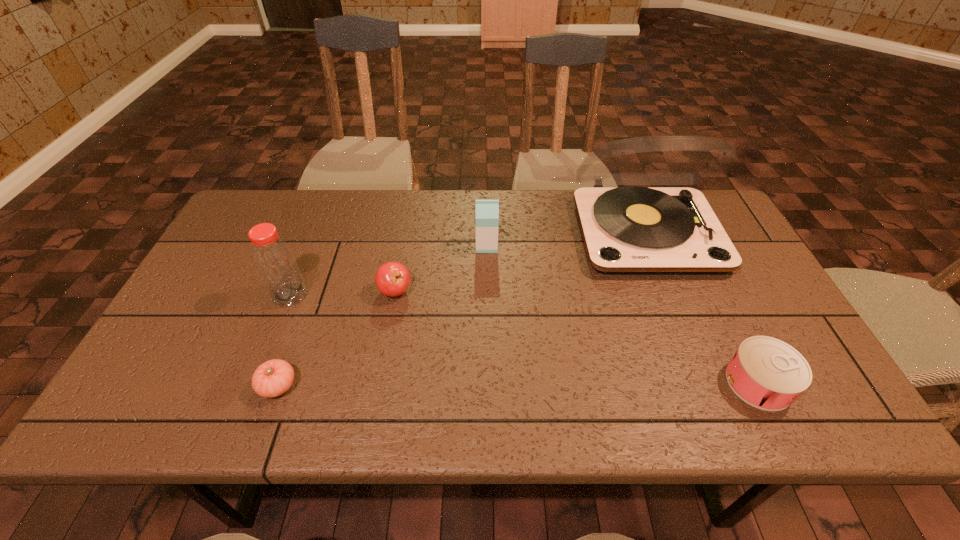
In order to click on vacant space located on the front of the fourth object from right to left in this screenshot , I will do `click(389, 326)`.

The width and height of the screenshot is (960, 540). In order to click on free spot located 0.190m on the back of the second shortest object in this screenshot , I will do `click(715, 294)`.

What are the coordinates of `vacant space positioned on the right of the shortest object` in the screenshot? It's located at (338, 386).

Identify the location of object that is at the far edge. click(627, 230).

You are a GUI agent. You are given a task and a screenshot of the screen. Output one action in this format:
    pyautogui.click(x=<x>, y=<y>)
    Task: Click on the can that is positioned at the near edge
    Image resolution: width=960 pixels, height=540 pixels.
    Given the screenshot: What is the action you would take?
    pyautogui.click(x=769, y=374)

Find the location of a particular element. This screenshot has width=960, height=540. tomato present at the near edge is located at coordinates (274, 377).

Locate an element on the screen. Image resolution: width=960 pixels, height=540 pixels. record player that is at the right edge is located at coordinates [627, 230].

This screenshot has height=540, width=960. I want to click on can located in the right edge section of the desktop, so click(769, 374).

Locate an element on the screen. This screenshot has height=540, width=960. object situated at the far right corner is located at coordinates (627, 230).

This screenshot has height=540, width=960. Identify the location of object that is at the near right corner. (769, 374).